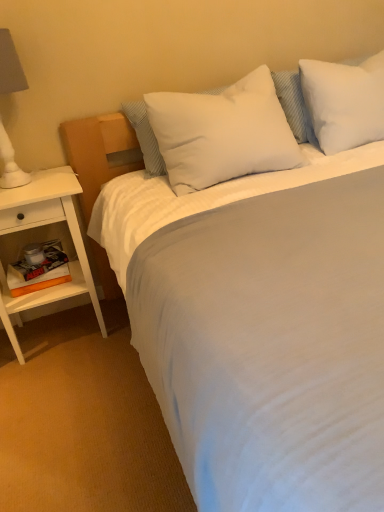
Question: Could you tell me if white matte lampshade at left is turned towards white wood nightstand at left?

Choices:
 (A) no
 (B) yes

Answer: (A)

Question: Is white matte lampshade at left not inside white wood nightstand at left?

Choices:
 (A) yes
 (B) no

Answer: (A)

Question: Is white matte lampshade at left oriented away from white wood nightstand at left?

Choices:
 (A) yes
 (B) no

Answer: (B)

Question: Considering the relative sizes of white matte lampshade at left and white wood nightstand at left in the image provided, is white matte lampshade at left shorter than white wood nightstand at left?

Choices:
 (A) yes
 (B) no

Answer: (A)

Question: Is white wood nightstand at left a part of white matte lampshade at left?

Choices:
 (A) no
 (B) yes

Answer: (A)

Question: Is white soft pillow at center, arranged as the first pillow when viewed from the left, wider or thinner than white matte lampshade at left?

Choices:
 (A) thin
 (B) wide

Answer: (B)

Question: Is white soft pillow at center, marked as the second pillow in a right-to-left arrangement, in front of or behind white matte lampshade at left in the image?

Choices:
 (A) front
 (B) behind

Answer: (B)

Question: Considering the positions of white soft pillow at center, arranged as the first pillow when viewed from the left, and white matte lampshade at left in the image, is white soft pillow at center, arranged as the first pillow when viewed from the left, taller or shorter than white matte lampshade at left?

Choices:
 (A) tall
 (B) short

Answer: (B)

Question: Is white soft pillow at center, arranged as the first pillow when viewed from the left, to the left or to the right of white matte lampshade at left in the image?

Choices:
 (A) left
 (B) right

Answer: (B)

Question: Would you say white matte lampshade at left is inside or outside white soft pillow at upper right, which is the second pillow from left to right?

Choices:
 (A) inside
 (B) outside

Answer: (B)

Question: Is white matte lampshade at left wider or thinner than white soft pillow at upper right, the 1th pillow from the right?

Choices:
 (A) thin
 (B) wide

Answer: (A)

Question: In the image, is white matte lampshade at left on the left side or the right side of white soft pillow at upper right, the 1th pillow from the right?

Choices:
 (A) left
 (B) right

Answer: (A)

Question: Is white matte lampshade at left in front of or behind white soft pillow at upper right, which is the second pillow from left to right, in the image?

Choices:
 (A) behind
 (B) front

Answer: (B)

Question: In terms of size, does white wood nightstand at left appear bigger or smaller than white matte lampshade at left?

Choices:
 (A) small
 (B) big

Answer: (B)

Question: Considering their positions, is white wood nightstand at left located in front of or behind white matte lampshade at left?

Choices:
 (A) behind
 (B) front

Answer: (A)